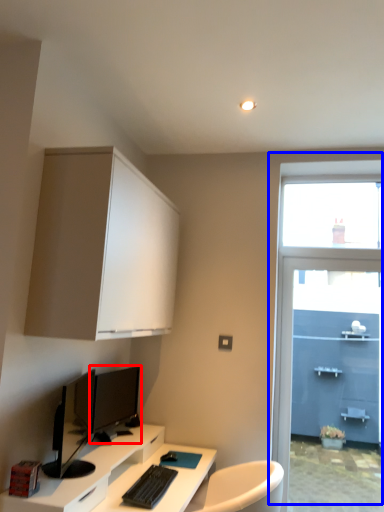
Question: Which object is closer to the camera taking this photo, computer monitor (highlighted by a red box) or window (highlighted by a blue box)?

Choices:
 (A) computer monitor
 (B) window

Answer: (A)